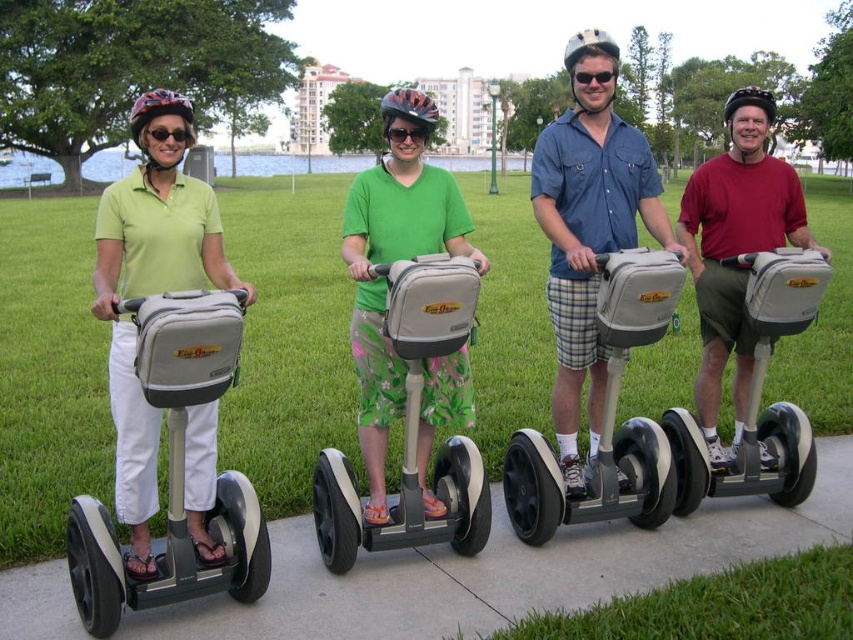
You are a tour guide leading a group on Segways. You notice two points marked on your map. The first point is at coordinate point (27, 580) and the second point is at coordinate point (389, 518). Your group needs to reach the point that is closer to the Segway riders. Which coordinate should you direct them to?

Point (27, 580) is closer to the Segway riders because it is in front of point (389, 518), meaning it is nearer to their current position.

You are standing at the origin point of the coordinate system in the image. Which Segway is closest to the point with coordinates [173,468]?

The matte gray scooter at left is located at point [173,468], so it is the closest Segway to that coordinate.

You are a tour guide leading a group of Segway riders. You notice two matte gray scooters, the matte gray scooter at left and the matte gray scooter at center. Which scooter is positioned more to the left?

The matte gray scooter at left is positioned more to the left than the matte gray scooter at center.